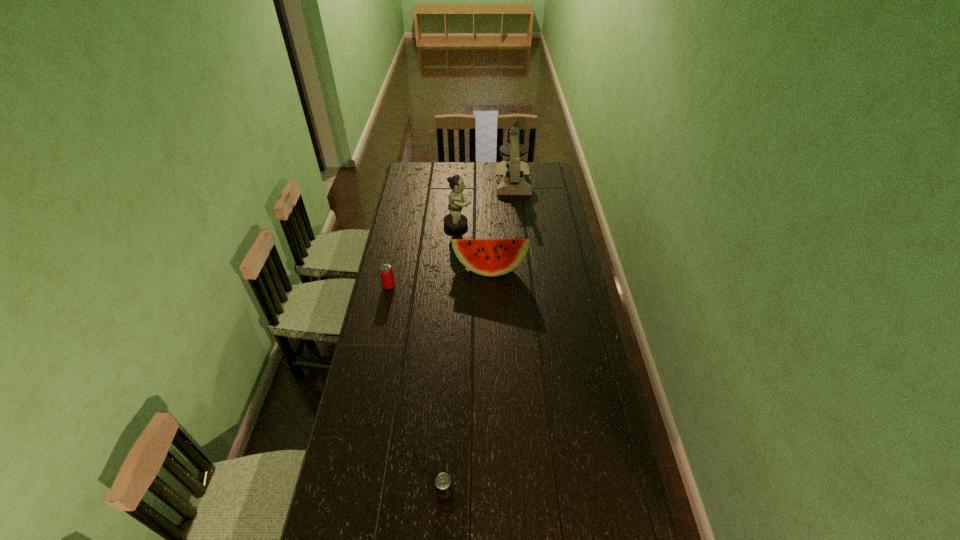
You are a GUI agent. You are given a task and a screenshot of the screen. Output one action in this format:
    pyautogui.click(x=<x>, y=<y>)
    Task: Click on the vacant region located at the eyepiece of the microscope
    
    Given the screenshot: What is the action you would take?
    pyautogui.click(x=516, y=204)

This screenshot has height=540, width=960. What are the coordinates of `vacant area situated on the front-facing side of the fourth shortest object` in the screenshot? It's located at click(523, 224).

At what (x,y) coordinates should I click in order to perform the action: click on vacant space located 0.270m on the outer rind of the third farthest object. Please return your answer as a coordinate pair (x, y). The width and height of the screenshot is (960, 540). Looking at the image, I should click on (491, 325).

Where is `vacant space positioned on the back of the nearer beer can`? The width and height of the screenshot is (960, 540). vacant space positioned on the back of the nearer beer can is located at coordinates (447, 458).

The height and width of the screenshot is (540, 960). In order to click on free space located on the front of the fourth farthest object in this screenshot , I will do `click(375, 352)`.

At what (x,y) coordinates should I click in order to perform the action: click on object at the far edge. Please return your answer as a coordinate pair (x, y). Image resolution: width=960 pixels, height=540 pixels. Looking at the image, I should click on (512, 177).

This screenshot has height=540, width=960. In order to click on object positioned at the left edge in this screenshot , I will do `click(387, 277)`.

I want to click on object positioned at the right edge, so click(512, 177).

You are a GUI agent. You are given a task and a screenshot of the screen. Output one action in this format:
    pyautogui.click(x=<x>, y=<y>)
    Task: Click on the object located in the far right corner section of the desktop
    Image resolution: width=960 pixels, height=540 pixels.
    Given the screenshot: What is the action you would take?
    pyautogui.click(x=512, y=177)

Where is `free spot at the far edge of the desktop`? The height and width of the screenshot is (540, 960). free spot at the far edge of the desktop is located at coordinates (439, 180).